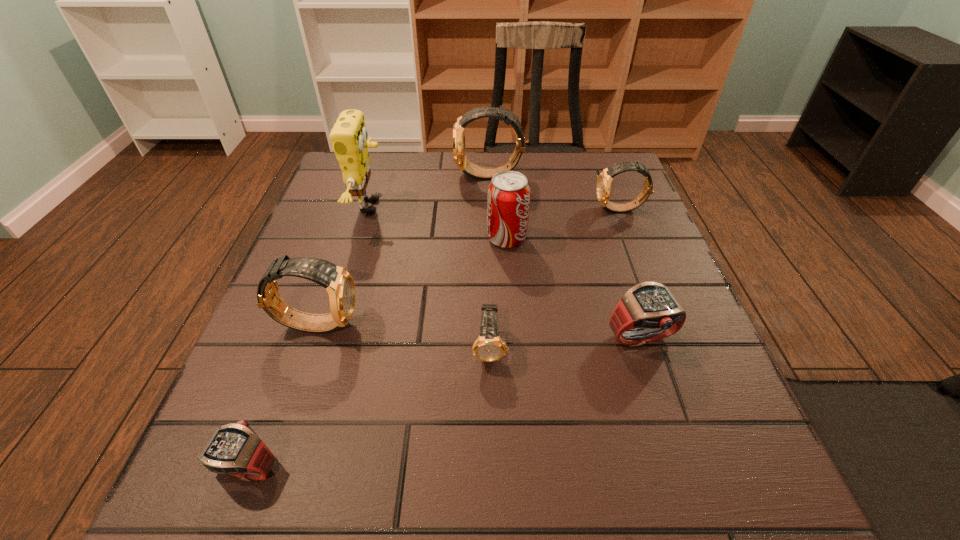
Locate which gold watch ranks third in proximity to the smallest gold watch. Please provide its 2D coordinates. Your answer should be formatted as a tuple, i.e. [(x, y)], where the tuple contains the x and y coordinates of a point satisfying the conditions above.

[(469, 168)]

I want to click on gold watch that stands as the fourth closest to the soda, so click(x=339, y=284).

The height and width of the screenshot is (540, 960). I want to click on vacant region that satisfies the following two spatial constraints: 1. on the face of the sponge; 2. on the left side of the right red watch, so click(331, 339).

Find the location of a particular element. The width and height of the screenshot is (960, 540). vacant space that satisfies the following two spatial constraints: 1. on the face of the third biggest gold watch; 2. on the face of the smallest gold watch is located at coordinates click(x=675, y=348).

Identify the location of vacant region that satisfies the following two spatial constraints: 1. on the face of the sponge; 2. on the left side of the farther red watch. (331, 339).

At what (x,y) coordinates should I click in order to perform the action: click on vacant space that satisfies the following two spatial constraints: 1. on the face of the soda; 2. on the right side of the farthest watch. Please return your answer as a coordinate pair (x, y). The width and height of the screenshot is (960, 540). Looking at the image, I should click on (492, 239).

In order to click on vacant space that satisfies the following two spatial constraints: 1. on the face of the soda; 2. on the left side of the tallest object in this screenshot , I will do `click(361, 239)`.

I want to click on vacant space that satisfies the following two spatial constraints: 1. on the face of the fifth nearest watch; 2. on the front side of the nearer red watch, so click(x=721, y=467).